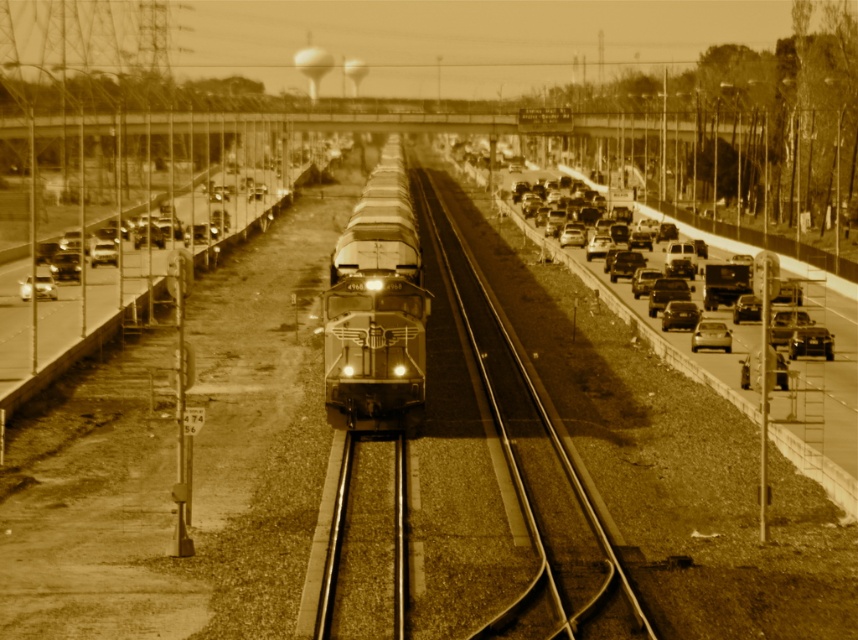
Question: Based on their relative distances, which object is farther from the matte black sedan at right?

Choices:
 (A) shiny black sedan at right
 (B) shiny silver sedan at center right
 (C) shiny black locomotive at center
 (D) metallic silver sedan at left

Answer: (D)

Question: Based on their relative distances, which object is farther from the shiny black locomotive at center?

Choices:
 (A) shiny silver sedan at center right
 (B) shiny black sedan at right

Answer: (B)

Question: Among these points, which one is farthest from the camera?

Choices:
 (A) (352, 404)
 (B) (674, 307)
 (C) (701, 321)

Answer: (B)

Question: Is shiny silver sedan at center right thinner than metallic silver sedan at left?

Choices:
 (A) yes
 (B) no

Answer: (A)

Question: Does matte black sedan at right have a larger size compared to metallic silver sedan at left?

Choices:
 (A) yes
 (B) no

Answer: (B)

Question: Can you confirm if matte black sedan at right is positioned above metallic silver sedan at left?

Choices:
 (A) yes
 (B) no

Answer: (B)